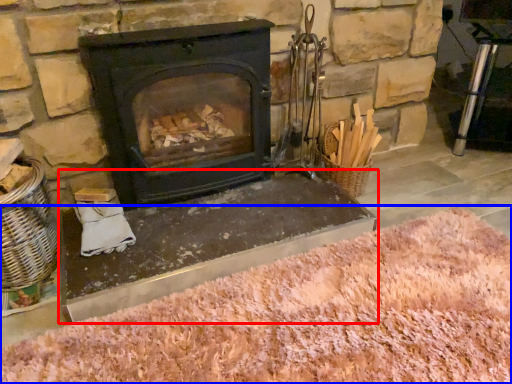
Question: Which point is closer to the camera, table (highlighted by a red box) or sand (highlighted by a blue box)?

Choices:
 (A) table
 (B) sand

Answer: (B)